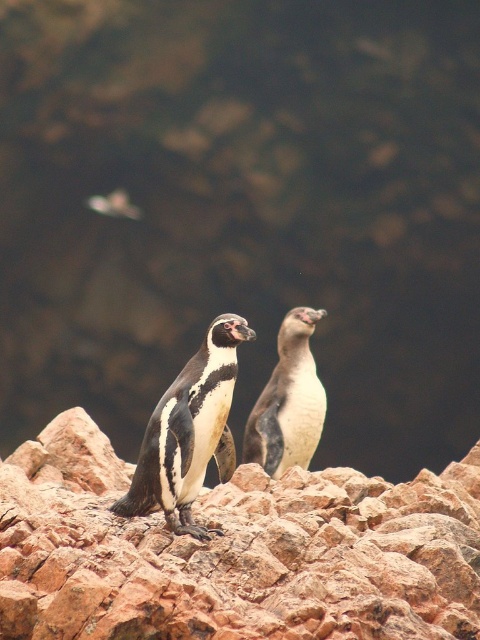
Is point (49, 614) behind point (188, 497)?

No, it is not.

In the scene shown: Does rusty stone rocks at center have a larger size compared to black glossy penguin at center?

Indeed, rusty stone rocks at center has a larger size compared to black glossy penguin at center.

In the scene shown: Who is more forward, (x=0, y=557) or (x=139, y=502)?

Point (x=0, y=557)

Locate an element on the screen. Image resolution: width=480 pixels, height=640 pixels. rusty stone rocks at center is located at coordinates coord(233,552).

This screenshot has width=480, height=640. Identify the location of black glossy penguin at center. (189, 433).

Which is below, black glossy penguin at center or white matte penguin at center?

Positioned lower is black glossy penguin at center.

Is point (157, 401) positioned in front of point (296, 387)?

No.

The image size is (480, 640). What are the coordinates of `black glossy penguin at center` in the screenshot? It's located at (189, 433).

Does rusty stone rocks at center have a larger size compared to white matte penguin at center?

Indeed, rusty stone rocks at center has a larger size compared to white matte penguin at center.

Describe the element at coordinates (233, 552) in the screenshot. I see `rusty stone rocks at center` at that location.

I want to click on rusty stone rocks at center, so coord(233,552).